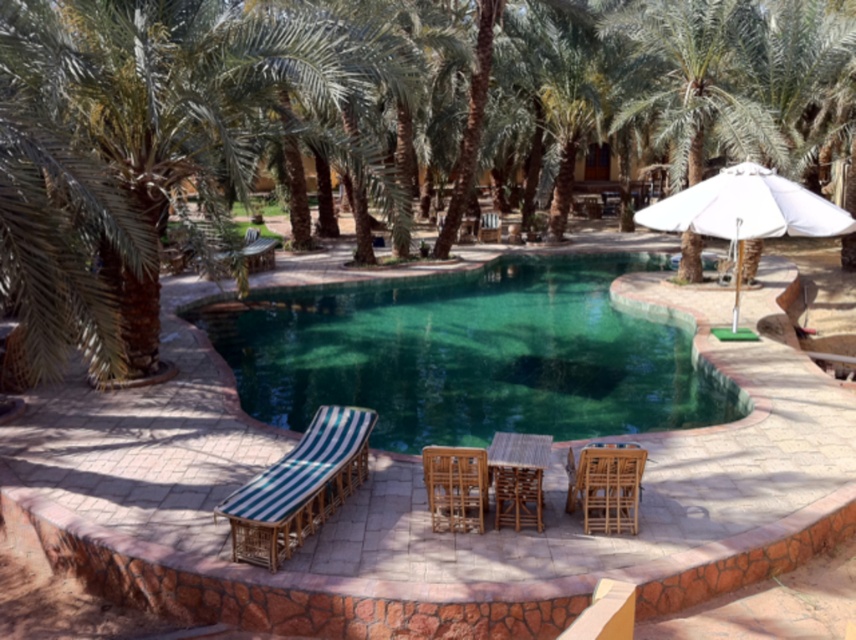
Is green glass swimming pool at center smaller than wooden chair at center?

Actually, green glass swimming pool at center might be larger than wooden chair at center.

Does point (655, 323) come closer to viewer compared to point (441, 513)?

No, (655, 323) is behind (441, 513).

This screenshot has width=856, height=640. Find the location of `green glass swimming pool at center`. green glass swimming pool at center is located at coordinates (468, 355).

Is wooden chair at center further to the viewer compared to wooden table at center?

No.

Is wooden chair at center closer to the viewer compared to wooden table at center?

That is True.

Locate an element on the screen. wooden chair at center is located at coordinates (455, 486).

Where is `wooden chair at center`? wooden chair at center is located at coordinates (455, 486).

Based on the photo, can you confirm if green striped fabric at lower left is positioned to the left of white fabric umbrella at upper right?

Yes, green striped fabric at lower left is to the left of white fabric umbrella at upper right.

Is green striped fabric at lower left further to camera compared to white fabric umbrella at upper right?

No, it is not.

Does point (296, 532) come behind point (818, 208)?

No, it is not.

The image size is (856, 640). I want to click on green striped fabric at lower left, so click(299, 486).